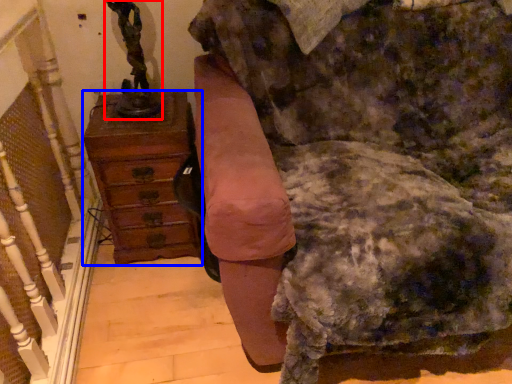
Question: Which of the following is the closest to the observer, sculpture (highlighted by a red box) or chest of drawers (highlighted by a blue box)?

Choices:
 (A) sculpture
 (B) chest of drawers

Answer: (A)